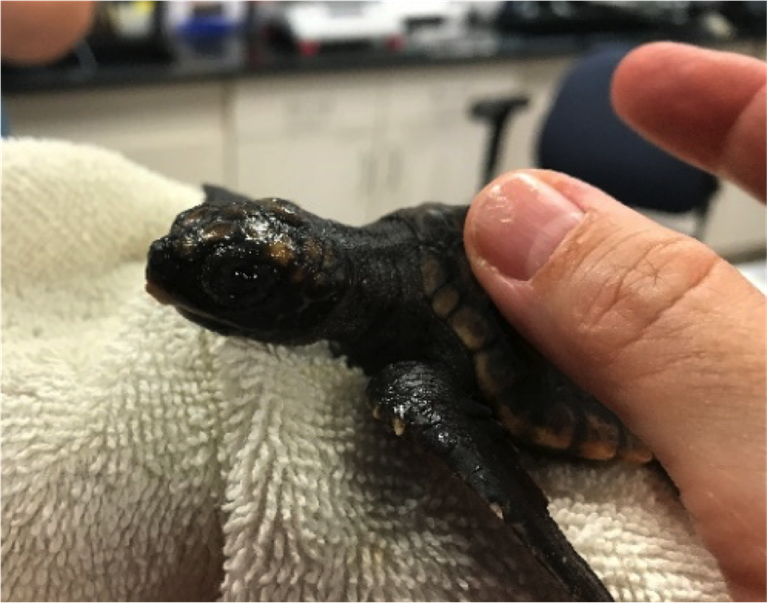
Find the location of a particular element. countertop is located at coordinates (154, 68), (378, 54), (522, 43).